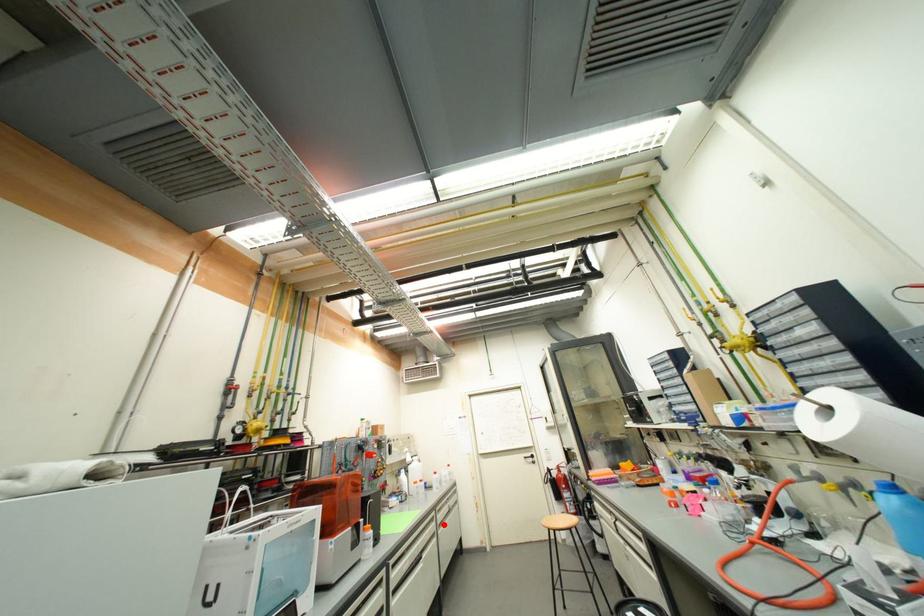
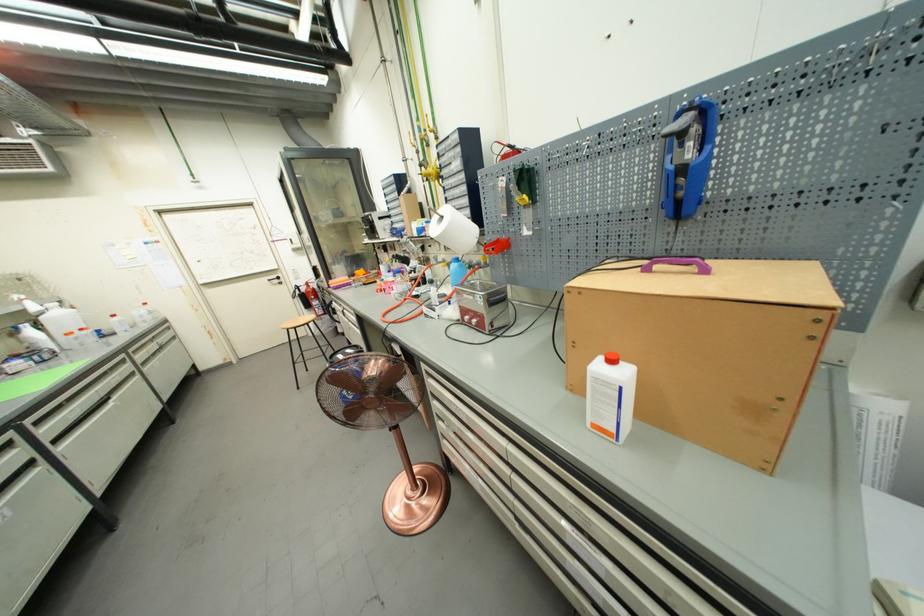
The point at the highlighted location is marked in the first image. Where is the corresponding point in the second image?

(146, 363)